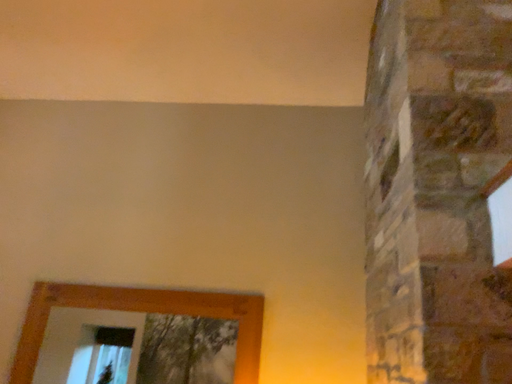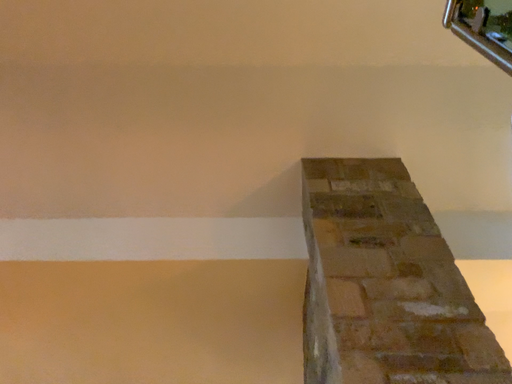
Question: Which way did the camera rotate in the video?

Choices:
 (A) rotated right
 (B) rotated left

Answer: (A)